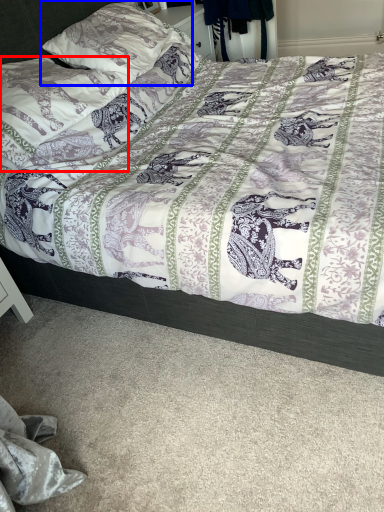
Question: Among these objects, which one is nearest to the camera, pillow (highlighted by a red box) or pillow (highlighted by a blue box)?

Choices:
 (A) pillow
 (B) pillow

Answer: (A)